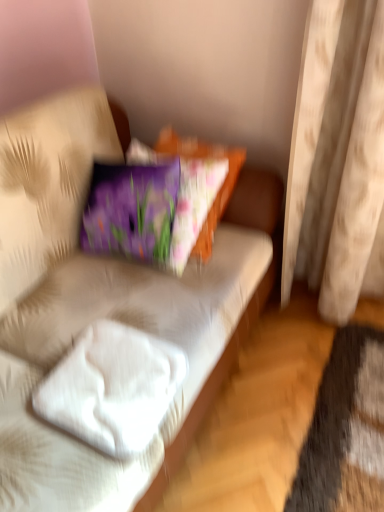
The width and height of the screenshot is (384, 512). What do you see at coordinates (338, 158) in the screenshot?
I see `beige fabric curtain at right` at bounding box center [338, 158].

The height and width of the screenshot is (512, 384). Describe the element at coordinates (106, 306) in the screenshot. I see `white fabric couch at center` at that location.

Describe the element at coordinates (112, 388) in the screenshot. The height and width of the screenshot is (512, 384). I see `white soft pillow at lower left` at that location.

I want to click on white soft pillow at lower left, so click(112, 388).

At what (x,y) coordinates should I click in order to perform the action: click on beige fabric curtain at right. Please return your answer as a coordinate pair (x, y). Looking at the image, I should click on (338, 158).

In terms of width, does white fabric couch at center look wider or thinner when compared to beige fabric curtain at right?

Considering their sizes, white fabric couch at center looks broader than beige fabric curtain at right.

Measure the distance between white fabric couch at center and beige fabric curtain at right.

A distance of 52.42 centimeters exists between white fabric couch at center and beige fabric curtain at right.

Is white fabric couch at center looking in the opposite direction of beige fabric curtain at right?

No.

Locate an element on the screen. The image size is (384, 512). studio couch on the left of beige fabric curtain at right is located at coordinates (106, 306).

From a real-world perspective, is beige fabric curtain at right over white soft pillow at lower left?

Yes, from a real-world perspective, beige fabric curtain at right is over white soft pillow at lower left

Is beige fabric curtain at right inside the boundaries of white soft pillow at lower left, or outside?

beige fabric curtain at right is not enclosed by white soft pillow at lower left.

Is beige fabric curtain at right oriented away from white soft pillow at lower left?

No, beige fabric curtain at right's orientation is not away from white soft pillow at lower left.

From the image's perspective, is beige fabric curtain at right on white soft pillow at lower left?

Yes, from the image's perspective, beige fabric curtain at right is above white soft pillow at lower left.

Is white soft pillow at lower left in front of or behind white fabric couch at center in the image?

white soft pillow at lower left is in front of white fabric couch at center.

Considering the sizes of white soft pillow at lower left and white fabric couch at center in the image, is white soft pillow at lower left bigger or smaller than white fabric couch at center?

white soft pillow at lower left is smaller than white fabric couch at center.

Does white soft pillow at lower left have a lesser height compared to white fabric couch at center?

Yes.

Does white soft pillow at lower left contain white fabric couch at center?

No, white fabric couch at center is not surrounded by white soft pillow at lower left.

Where is `pillow that appears on the left of white fabric couch at center`? The width and height of the screenshot is (384, 512). pillow that appears on the left of white fabric couch at center is located at coordinates (112, 388).

Is white fabric couch at center bigger than white soft pillow at lower left?

Yes.

From the image's perspective, does white fabric couch at center appear lower than white soft pillow at lower left?

Indeed, from the image's perspective, white fabric couch at center is shown beneath white soft pillow at lower left.

Considering the relative sizes of white fabric couch at center and white soft pillow at lower left in the image provided, is white fabric couch at center wider than white soft pillow at lower left?

Yes.

What's the angular difference between white soft pillow at lower left and beige fabric curtain at right's facing directions?

white soft pillow at lower left and beige fabric curtain at right are facing 91.8 degrees away from each other.

In the image, is white soft pillow at lower left on the left side or the right side of beige fabric curtain at right?

white soft pillow at lower left is to the left of beige fabric curtain at right.

Is white soft pillow at lower left not near beige fabric curtain at right?

Actually, white soft pillow at lower left and beige fabric curtain at right are a little close together.

In the image, is white soft pillow at lower left positioned in front of or behind beige fabric curtain at right?

In the image, white soft pillow at lower left appears in front of beige fabric curtain at right.

Between point (324, 149) and point (23, 503), which one is positioned in front?

The point (23, 503) is more forward.

Could you tell me if beige fabric curtain at right is turned towards white fabric couch at center?

No, beige fabric curtain at right is not facing towards white fabric couch at center.

Is beige fabric curtain at right smaller than white fabric couch at center?

Yes, beige fabric curtain at right is smaller than white fabric couch at center.

The width and height of the screenshot is (384, 512). I want to click on studio couch below the beige fabric curtain at right (from a real-world perspective), so click(106, 306).

The width and height of the screenshot is (384, 512). I want to click on pillow that is in front of the beige fabric curtain at right, so click(112, 388).

Looking at the image, which one is located further to beige fabric curtain at right, white soft pillow at lower left or white fabric couch at center?

white soft pillow at lower left.

Estimate the real-world distances between objects in this image. Which object is closer to beige fabric curtain at right, white fabric couch at center or white soft pillow at lower left?

white fabric couch at center.

Which object lies further to the anchor point white soft pillow at lower left, white fabric couch at center or beige fabric curtain at right?

Based on the image, beige fabric curtain at right appears to be further to white soft pillow at lower left.

Looking at the image, which one is located closer to white fabric couch at center, white soft pillow at lower left or beige fabric curtain at right?

white soft pillow at lower left.

From the picture: Which object lies nearer to the anchor point white soft pillow at lower left, beige fabric curtain at right or white fabric couch at center?

white fabric couch at center is closer to white soft pillow at lower left.

Estimate the real-world distances between objects in this image. Which object is closer to white fabric couch at center, beige fabric curtain at right or white soft pillow at lower left?

The object closer to white fabric couch at center is white soft pillow at lower left.

Locate an element on the screen. The image size is (384, 512). studio couch between white soft pillow at lower left and beige fabric curtain at right from left to right is located at coordinates (106, 306).